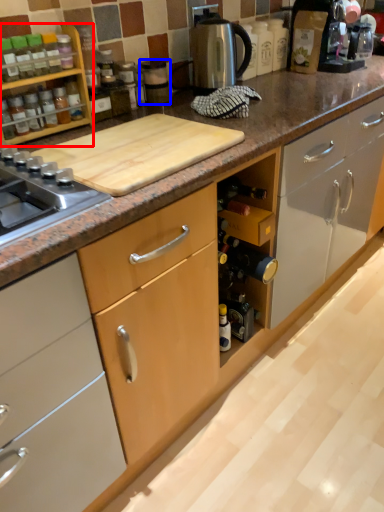
Question: Which object is further to the camera taking this photo, kitchen appliance (highlighted by a red box) or appliance (highlighted by a blue box)?

Choices:
 (A) kitchen appliance
 (B) appliance

Answer: (B)